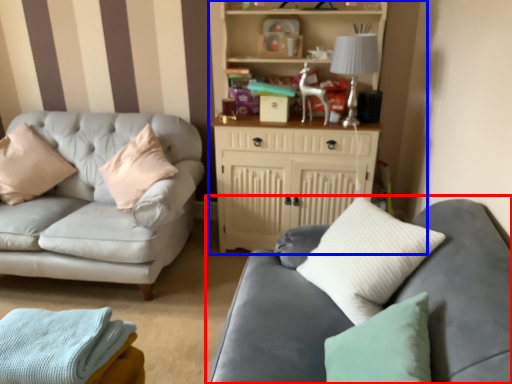
Question: Which object appears closest to the camera in this image, studio couch (highlighted by a red box) or entertainment center (highlighted by a blue box)?

Choices:
 (A) studio couch
 (B) entertainment center

Answer: (A)